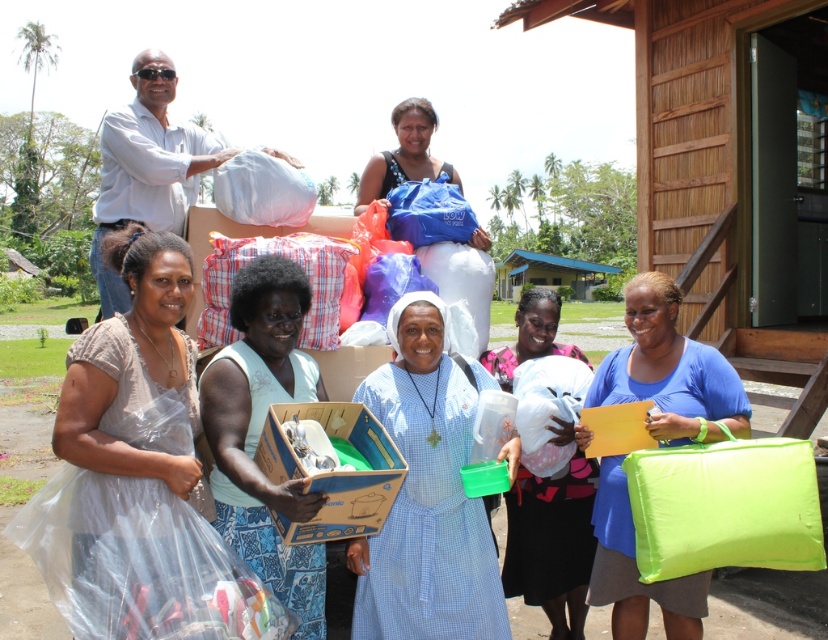
Based on the photo, you are organizing a clothing donation event and need to determine which item takes up more space horizontally. Based on the scene, which object is wider between the blue checkered dress at center and the light blue fabric at center?

The blue checkered dress at center is wider than the light blue fabric at center according to the description.

You are a photographer trying to capture the light blue fabric at center in your shot. Based on its position, where should you aim your camera?

The light blue fabric at center is located at point 0.678 on the horizontal axis and 0.314 on the vertical axis, so you should aim your camera towards the coordinates approximately 0.678 horizontally and 0.314 vertically to capture it.